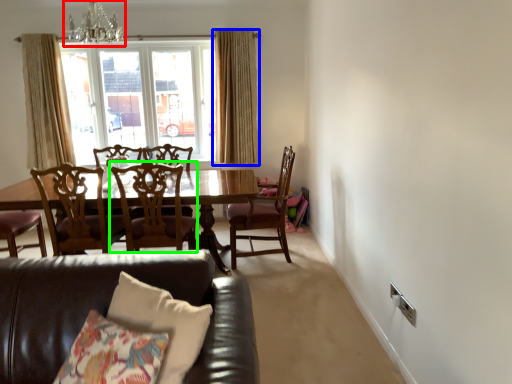
Question: Estimate the real-world distances between objects in this image. Which object is farther from chandelier (highlighted by a red box), curtain (highlighted by a blue box) or chair (highlighted by a green box)?

Choices:
 (A) curtain
 (B) chair

Answer: (B)